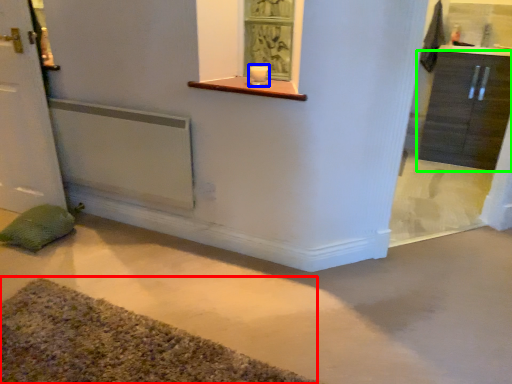
Question: Considering the real-world distances, which object is farthest from bath mat (highlighted by a red box)? candle holder (highlighted by a blue box) or cabinetry (highlighted by a green box)?

Choices:
 (A) candle holder
 (B) cabinetry

Answer: (B)